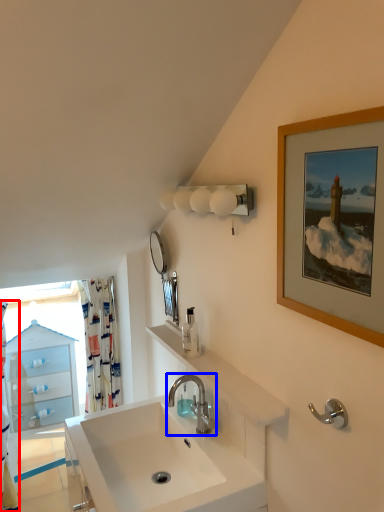
Question: Among these objects, which one is nearest to the camera, shower curtain (highlighted by a red box) or tap (highlighted by a blue box)?

Choices:
 (A) shower curtain
 (B) tap

Answer: (B)